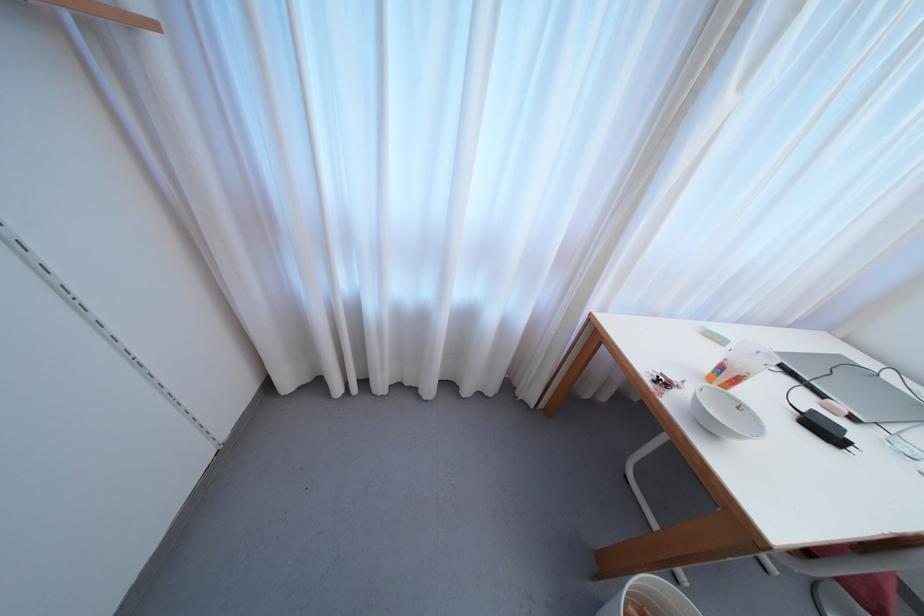
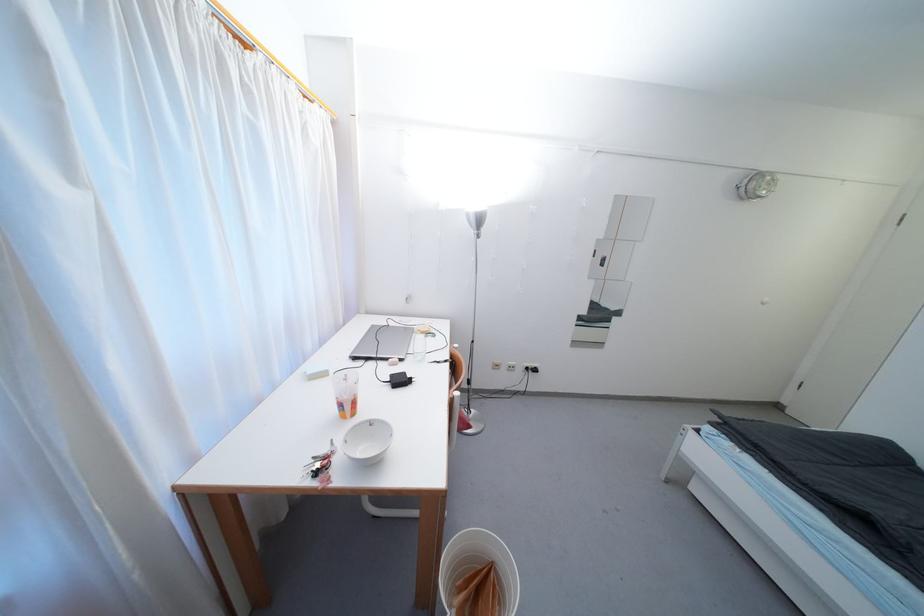
The point at (752,411) is marked in the first image. Where is the corresponding point in the second image?

(379, 423)